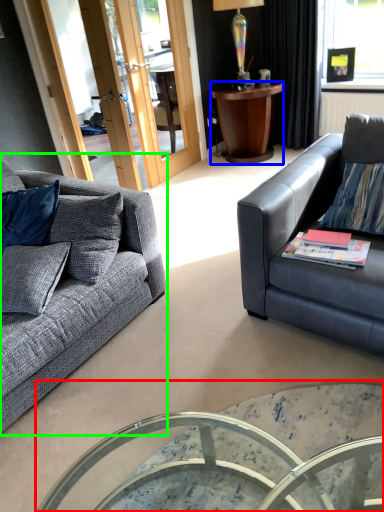
Question: Which object is the farthest from coffee table (highlighted by a red box)? Choose among these: desk (highlighted by a blue box) or studio couch (highlighted by a green box).

Choices:
 (A) desk
 (B) studio couch

Answer: (A)